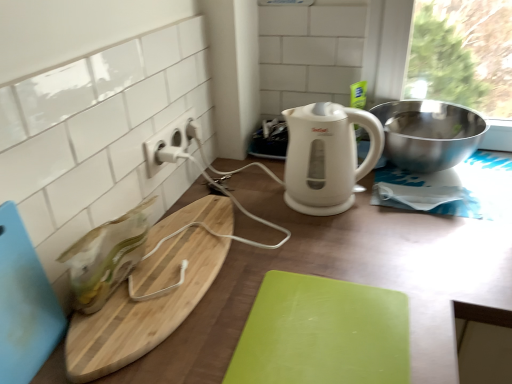
Find the location of a particular element. The image size is (512, 384). vacant region in front of polished stainless steel bowl at upper right is located at coordinates (430, 228).